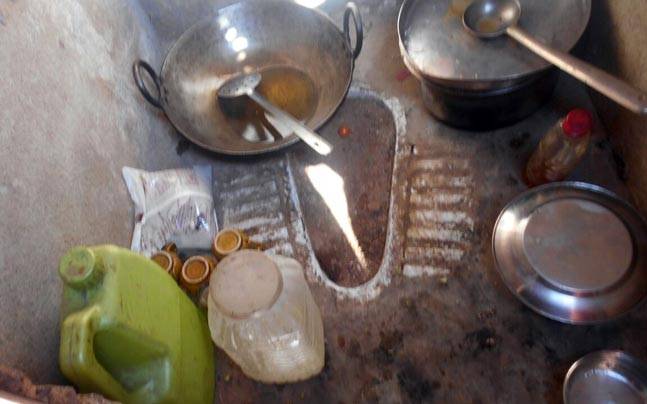
The height and width of the screenshot is (404, 647). Identify the location of floor. (408, 333).